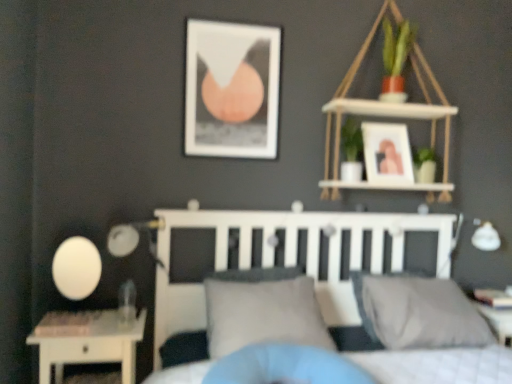
Question: Is white wood shelf at upper right wider than gray fabric pillow at center, the first pillow positioned from the left?

Choices:
 (A) no
 (B) yes

Answer: (A)

Question: Is white wood shelf at upper right shorter than gray fabric pillow at center, which is the 2th pillow from right to left?

Choices:
 (A) yes
 (B) no

Answer: (B)

Question: Is white wood shelf at upper right far away from gray fabric pillow at center, which is the 2th pillow from right to left?

Choices:
 (A) yes
 (B) no

Answer: (B)

Question: Considering the relative sizes of white wood shelf at upper right and gray fabric pillow at center, which is the 2th pillow from right to left, in the image provided, is white wood shelf at upper right smaller than gray fabric pillow at center, which is the 2th pillow from right to left,?

Choices:
 (A) yes
 (B) no

Answer: (B)

Question: Is white wood shelf at upper right taller than gray fabric pillow at center, which is the 2th pillow from right to left?

Choices:
 (A) yes
 (B) no

Answer: (A)

Question: Is white matte bed at center to the left or to the right of gray fabric pillow at center, the 2th pillow viewed from the left, in the image?

Choices:
 (A) right
 (B) left

Answer: (B)

Question: Considering the positions of white matte bed at center and gray fabric pillow at center, which ranks as the 1th pillow in right-to-left order, in the image, is white matte bed at center wider or thinner than gray fabric pillow at center, which ranks as the 1th pillow in right-to-left order,?

Choices:
 (A) wide
 (B) thin

Answer: (A)

Question: From the image's perspective, relative to gray fabric pillow at center, which ranks as the 1th pillow in right-to-left order, is white matte bed at center above or below?

Choices:
 (A) below
 (B) above

Answer: (A)

Question: Is point (442, 233) positioned closer to the camera than point (457, 304)?

Choices:
 (A) closer
 (B) farther

Answer: (B)

Question: In terms of width, does matte black picture frame at upper center, which is counted as the 1th picture frame, starting from the left, look wider or thinner when compared to matte black table lamp at left?

Choices:
 (A) wide
 (B) thin

Answer: (B)

Question: From a real-world perspective, relative to matte black table lamp at left, is matte black picture frame at upper center, the second picture frame in the right-to-left sequence, vertically above or below?

Choices:
 (A) above
 (B) below

Answer: (A)

Question: Considering their positions, is matte black picture frame at upper center, which is counted as the 1th picture frame, starting from the left, located in front of or behind matte black table lamp at left?

Choices:
 (A) behind
 (B) front

Answer: (A)

Question: Is matte black picture frame at upper center, which is counted as the 1th picture frame, starting from the left, to the left or to the right of matte black table lamp at left in the image?

Choices:
 (A) right
 (B) left

Answer: (A)

Question: In the image, is gray fabric pillow at center, which is the 2th pillow from right to left, positioned in front of or behind matte white picture frame at upper right, the second picture frame in the left-to-right sequence?

Choices:
 (A) front
 (B) behind

Answer: (A)

Question: From the image's perspective, is gray fabric pillow at center, the first pillow positioned from the left, above or below matte white picture frame at upper right, the 1th picture frame in the right-to-left sequence?

Choices:
 (A) below
 (B) above

Answer: (A)